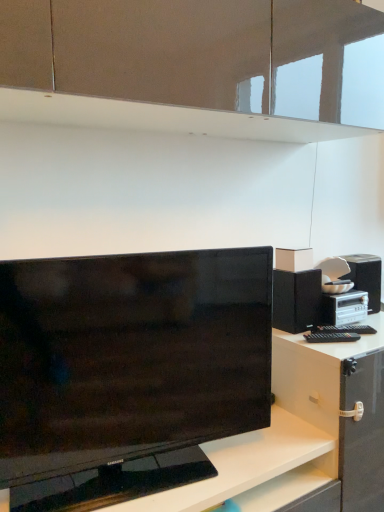
Question: Can you confirm if black glossy tv at center is positioned to the left of black matte speaker at right?

Choices:
 (A) yes
 (B) no

Answer: (A)

Question: Would you say black glossy tv at center is outside black matte speaker at right?

Choices:
 (A) yes
 (B) no

Answer: (A)

Question: Does black glossy tv at center have a smaller size compared to black matte speaker at right?

Choices:
 (A) yes
 (B) no

Answer: (B)

Question: Does black glossy tv at center have a greater width compared to black matte speaker at right?

Choices:
 (A) no
 (B) yes

Answer: (A)

Question: Could you tell me if black glossy tv at center is turned towards black matte speaker at right?

Choices:
 (A) no
 (B) yes

Answer: (A)

Question: Is black glossy tv at center positioned with its back to black matte speaker at right?

Choices:
 (A) yes
 (B) no

Answer: (B)

Question: Does black matte speaker at right have a lesser height compared to black glossy tv at center?

Choices:
 (A) no
 (B) yes

Answer: (B)

Question: From the image's perspective, does black matte speaker at right appear lower than black glossy tv at center?

Choices:
 (A) no
 (B) yes

Answer: (A)

Question: Is black matte speaker at right smaller than black glossy tv at center?

Choices:
 (A) no
 (B) yes

Answer: (B)

Question: Considering the relative sizes of black matte speaker at right and black glossy tv at center in the image provided, is black matte speaker at right taller than black glossy tv at center?

Choices:
 (A) no
 (B) yes

Answer: (A)

Question: From a real-world perspective, is black matte speaker at right positioned over black glossy tv at center based on gravity?

Choices:
 (A) yes
 (B) no

Answer: (A)

Question: Is black matte speaker at right to the right of black glossy tv at center from the viewer's perspective?

Choices:
 (A) no
 (B) yes

Answer: (B)

Question: Considering the relative positions of black matte speaker at right and black glossy tv at center in the image provided, is black matte speaker at right to the left or to the right of black glossy tv at center?

Choices:
 (A) right
 (B) left

Answer: (A)